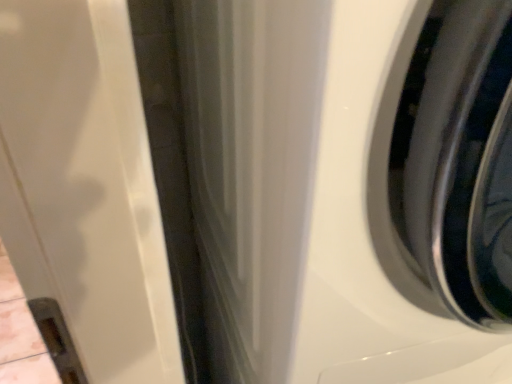
The image size is (512, 384). What do you see at coordinates (461, 159) in the screenshot?
I see `metallic silver wheel at center right` at bounding box center [461, 159].

This screenshot has width=512, height=384. I want to click on metallic silver wheel at center right, so click(461, 159).

Measure the distance between point (x=471, y=209) and camera.

The distance of point (x=471, y=209) from camera is 10.79 inches.

Where is `white glossy washing machine at right`? This screenshot has width=512, height=384. white glossy washing machine at right is located at coordinates (368, 237).

Describe the element at coordinates (368, 237) in the screenshot. I see `white glossy washing machine at right` at that location.

You are a GUI agent. You are given a task and a screenshot of the screen. Output one action in this format:
    pyautogui.click(x=<x>, y=<y>)
    Task: Click on the metallic silver wheel at center right
    
    Given the screenshot: What is the action you would take?
    pyautogui.click(x=461, y=159)

Can you confirm if white glossy washing machine at right is positioned to the right of metallic silver wheel at center right?

Incorrect, white glossy washing machine at right is not on the right side of metallic silver wheel at center right.

Is white glossy washing machine at right behind metallic silver wheel at center right?

No, white glossy washing machine at right is in front of metallic silver wheel at center right.

Looking at this image, which is further, (x=443, y=370) or (x=510, y=233)?

The point (x=443, y=370) is behind.

From the image's perspective, which one is positioned higher, white glossy washing machine at right or metallic silver wheel at center right?

metallic silver wheel at center right appears higher in the image.

From a real-world perspective, is white glossy washing machine at right above or below metallic silver wheel at center right?

In terms of real-world spatial position, white glossy washing machine at right is above metallic silver wheel at center right.

Which object is wider, white glossy washing machine at right or metallic silver wheel at center right?

white glossy washing machine at right.

Between white glossy washing machine at right and metallic silver wheel at center right, which one has more height?

white glossy washing machine at right.

Considering the sizes of white glossy washing machine at right and metallic silver wheel at center right in the image, is white glossy washing machine at right bigger or smaller than metallic silver wheel at center right?

In the image, white glossy washing machine at right appears to be larger than metallic silver wheel at center right.

Is white glossy washing machine at right completely or partially outside of metallic silver wheel at center right?

Yes, white glossy washing machine at right is located beyond the bounds of metallic silver wheel at center right.

In the scene shown: Would you say white glossy washing machine at right is a long distance from metallic silver wheel at center right?

No.

Looking at this image, is white glossy washing machine at right facing towards metallic silver wheel at center right?

No, white glossy washing machine at right is not oriented towards metallic silver wheel at center right.

What's the angular difference between white glossy washing machine at right and metallic silver wheel at center right's facing directions?

The angle between the facing direction of white glossy washing machine at right and the facing direction of metallic silver wheel at center right is 0.168 degrees.

At what (x,y) coordinates should I click in order to perform the action: click on wheel above the white glossy washing machine at right (from the image's perspective). Please return your answer as a coordinate pair (x, y). Looking at the image, I should click on (461, 159).

Is metallic silver wheel at center right to the right of white glossy washing machine at right from the viewer's perspective?

Yes, metallic silver wheel at center right is to the right of white glossy washing machine at right.

Is metallic silver wheel at center right positioned behind white glossy washing machine at right?

Yes, metallic silver wheel at center right is further from the viewer.

Does point (489, 83) appear closer or farther from the camera than point (367, 119)?

Point (489, 83) is closer to the camera than point (367, 119).

From the image's perspective, is metallic silver wheel at center right located above or below white glossy washing machine at right?

Clearly, from the image's perspective, metallic silver wheel at center right is above white glossy washing machine at right.

From a real-world perspective, is metallic silver wheel at center right positioned above or below white glossy washing machine at right?

In terms of real-world spatial position, metallic silver wheel at center right is below white glossy washing machine at right.

Considering the sizes of metallic silver wheel at center right and white glossy washing machine at right in the image, is metallic silver wheel at center right wider or thinner than white glossy washing machine at right?

metallic silver wheel at center right is thinner than white glossy washing machine at right.

Is metallic silver wheel at center right taller or shorter than white glossy washing machine at right?

In the image, metallic silver wheel at center right appears to be shorter than white glossy washing machine at right.

Between metallic silver wheel at center right and white glossy washing machine at right, which one has smaller size?

With smaller size is metallic silver wheel at center right.

Is white glossy washing machine at right inside metallic silver wheel at center right?

No, white glossy washing machine at right is not surrounded by metallic silver wheel at center right.

Are metallic silver wheel at center right and white glossy washing machine at right beside each other?

Yes, metallic silver wheel at center right is with white glossy washing machine at right.

Is metallic silver wheel at center right facing away from white glossy washing machine at right?

No, white glossy washing machine at right is not at the back of metallic silver wheel at center right.

What's the angular difference between metallic silver wheel at center right and white glossy washing machine at right's facing directions?

They differ by 0.168 degrees in their facing directions.

You are a GUI agent. You are given a task and a screenshot of the screen. Output one action in this format:
    pyautogui.click(x=<x>, y=<y>)
    Task: Click on the wheel behind the white glossy washing machine at right
    
    Given the screenshot: What is the action you would take?
    pyautogui.click(x=461, y=159)

Locate an element on the screen. The height and width of the screenshot is (384, 512). washing machine in front of the metallic silver wheel at center right is located at coordinates (368, 237).

In order to click on washing machine lying on the left of metallic silver wheel at center right in this screenshot , I will do `click(368, 237)`.